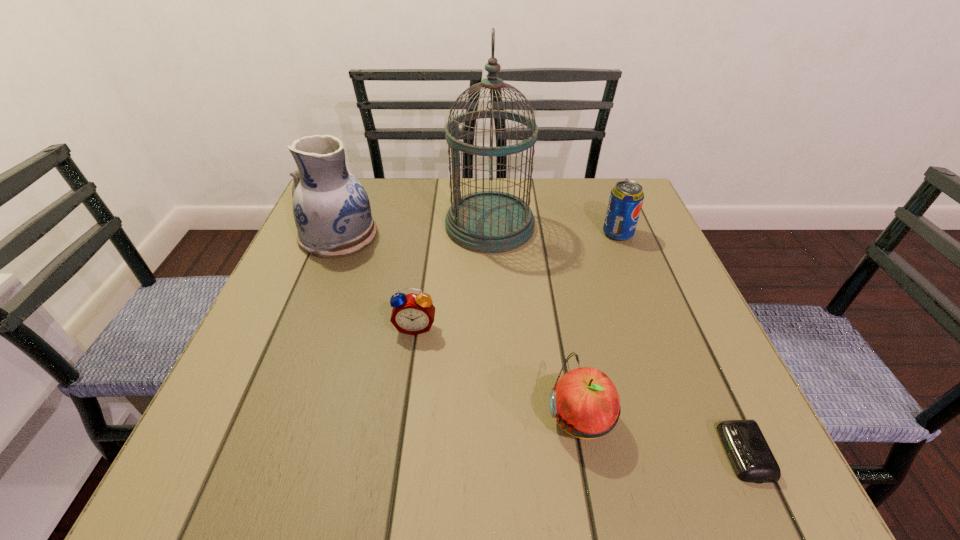
In order to click on birdcage in this screenshot , I will do `click(489, 221)`.

The width and height of the screenshot is (960, 540). Identify the location of the leftmost object. point(331,209).

This screenshot has height=540, width=960. I want to click on the second tallest object, so click(331, 209).

At what (x,y) coordinates should I click in order to perform the action: click on soda. Please return your answer as a coordinate pair (x, y). The image size is (960, 540). Looking at the image, I should click on (626, 198).

You are a GUI agent. You are given a task and a screenshot of the screen. Output one action in this format:
    pyautogui.click(x=<x>, y=<y>)
    Task: Click on the apple
    This screenshot has width=960, height=540.
    Given the screenshot: What is the action you would take?
    pyautogui.click(x=586, y=403)

Locate an element on the screen. the farther alarm clock is located at coordinates (413, 314).

Locate an element on the screen. the third nearest object is located at coordinates (413, 314).

Locate an element on the screen. Image resolution: width=960 pixels, height=540 pixels. the shorter alarm clock is located at coordinates (747, 449).

Locate an element on the screen. the nearer alarm clock is located at coordinates (747, 449).

Locate an element on the screen. The image size is (960, 540). free spot located 0.200m on the front-facing side of the birdcage is located at coordinates (364, 226).